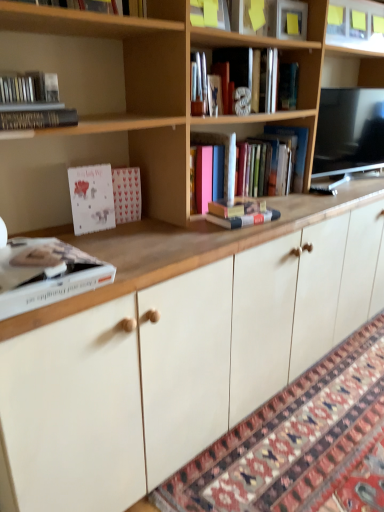
Question: Considering the positions of metallic silver letter at upper center, the 6th book from the left, and wooden bookcase at upper center in the image, is metallic silver letter at upper center, the 6th book from the left, taller or shorter than wooden bookcase at upper center?

Choices:
 (A) short
 (B) tall

Answer: (A)

Question: From the image's perspective, is metallic silver letter at upper center, the second book in the right-to-left sequence, located above or below wooden bookcase at upper center?

Choices:
 (A) below
 (B) above

Answer: (B)

Question: Which is farther from the matte black bookshelf at upper left, marked as the first book in a left-to-right arrangement?

Choices:
 (A) hardcover book at center, which is the 7th book in left-to-right order
 (B) metallic silver letter at upper center, the second book in the right-to-left sequence
 (C) wooden bookcase at upper center
 (D) patterned carpet at lower right
 (E) white glossy shelf at upper center

Answer: (E)

Question: Which is farther from the hardcover book at center, which is the first book in right-to-left order?

Choices:
 (A) patterned carpet at lower right
 (B) hardcover book at center, which is the 4th book from left to right
 (C) white glossy shelf at upper center
 (D) white matte book at lower left, which is the third book from left to right
 (E) hardcover book at center, the 5th book positioned from the left

Answer: (D)